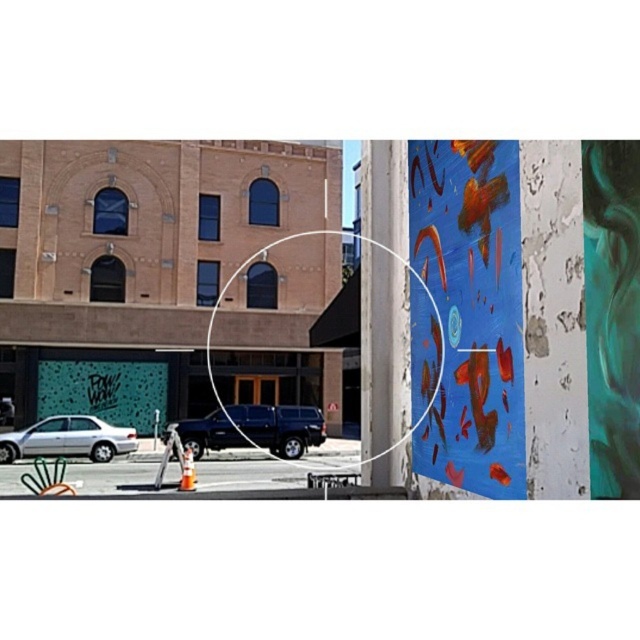
You are a photographer standing in the middle of the street. You want to take a photo that includes both point [493,417] and point [3,445]. Which point should you focus on first to ensure both are in sharp focus?

You should focus on point [493,417] first because it is closer to the camera than point [3,445], ensuring both will be in focus when using a small aperture for a deep depth of field.

You are an art curator planning to display the blue painted canvas at right and the silver metallic car at lower left in a gallery. Given their sizes, which object would require a wider display space?

The silver metallic car at lower left requires a wider display space because it has a greater width than the blue painted canvas at right.

You are an art collector who wants to hang the blue painted canvas at right on the wall behind the shiny black suv at center. Based on their sizes, will the canvas fit vertically above the SUV?

The blue painted canvas at right is much taller than the shiny black suv at center, so it will not fit vertically above the SUV as it exceeds the SUVs height.